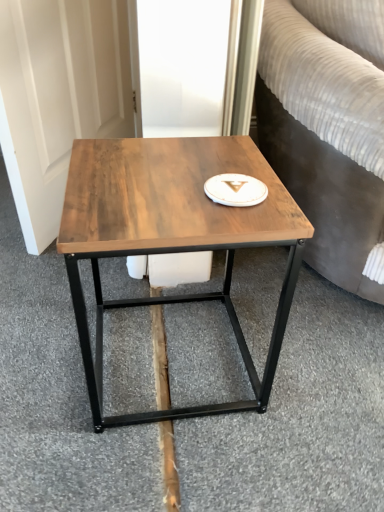
Find the location of a particular element. free space above wooden table at center (from a real-world perspective) is located at coordinates coord(165,179).